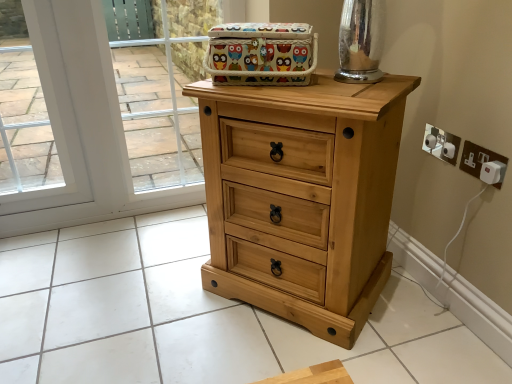
Where is `free space in front of owl-patterned fabric basket at upper center`? free space in front of owl-patterned fabric basket at upper center is located at coordinates (292, 95).